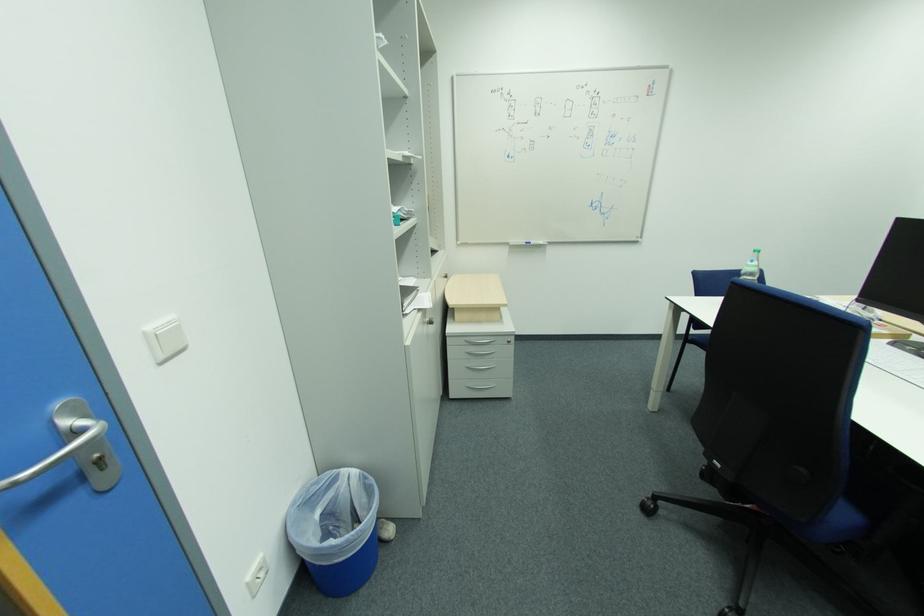
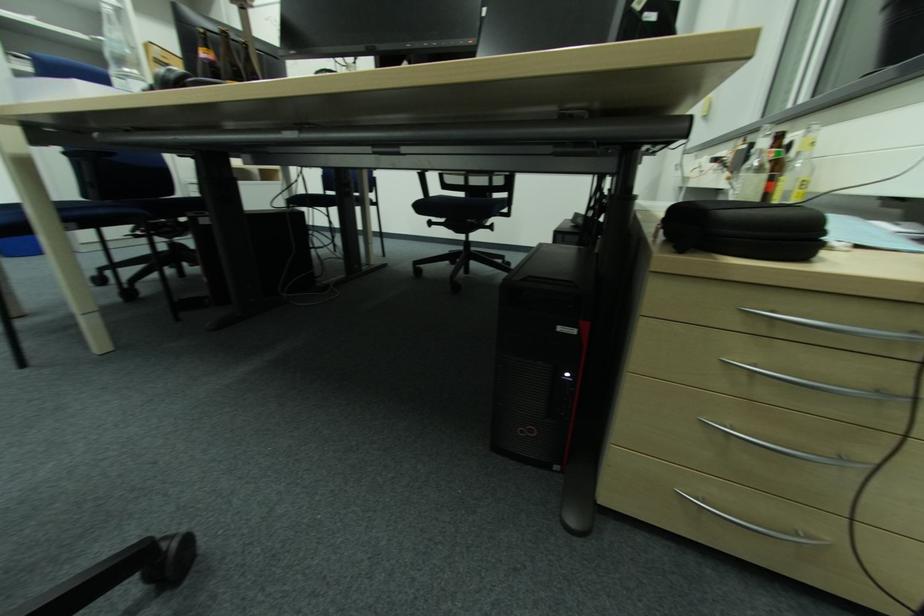
Question: What movement of the cameraman would produce the second image?

Choices:
 (A) Left
 (B) Right
 (C) Forward
 (D) Backward

Answer: (B)